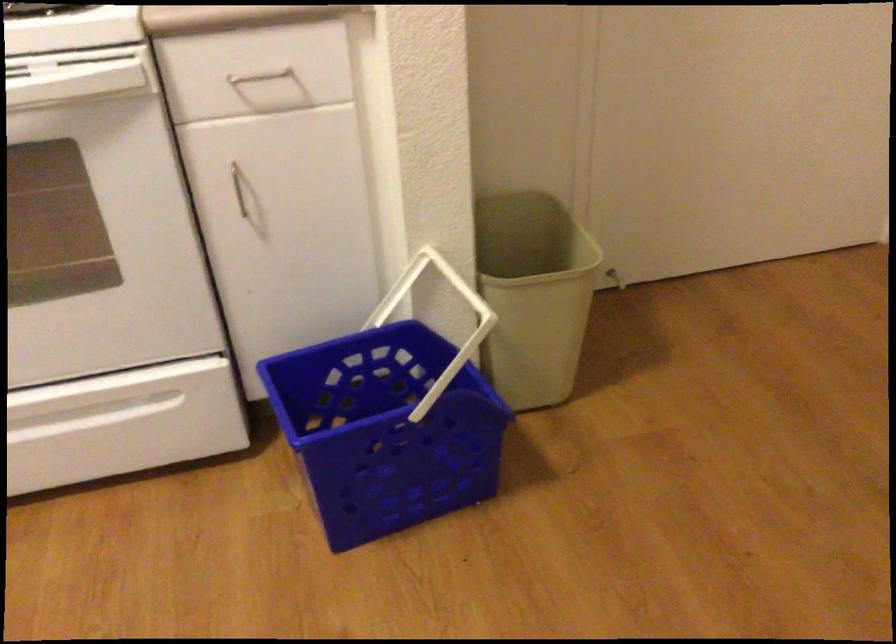
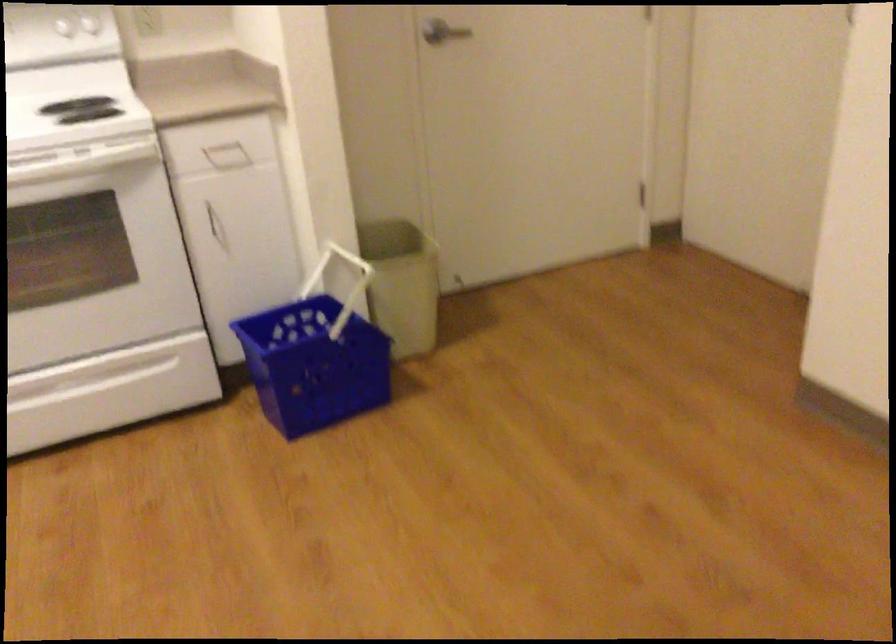
Question: The first image is from the beginning of the video and the second image is from the end. How did the camera likely rotate when shooting the video?

Choices:
 (A) Left
 (B) Right
 (C) Up
 (D) Down

Answer: (C)